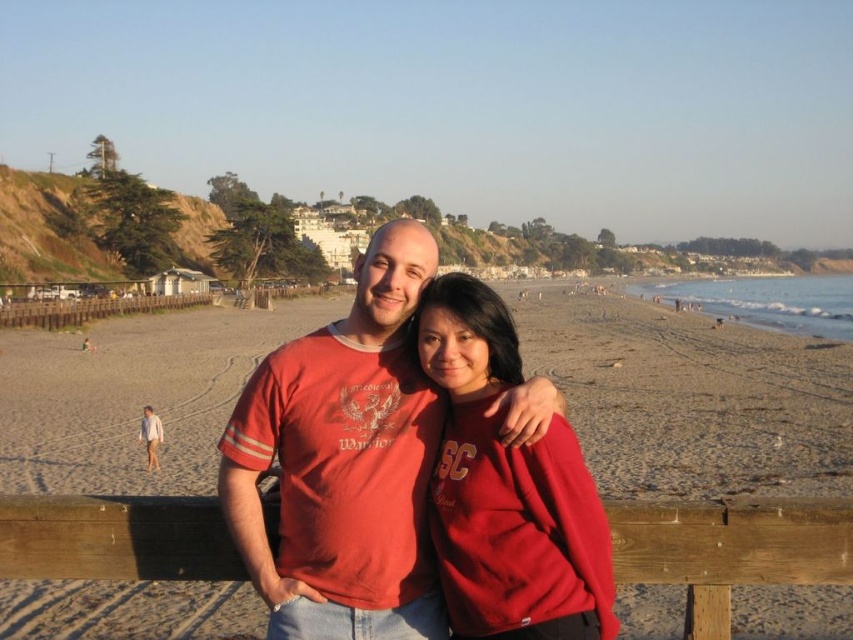
Is matte red t-shirt at center smaller than matte red sweatshirt at center?

No.

Does matte red t-shirt at center lie behind matte red sweatshirt at center?

Yes.

Is point (283, 628) closer to viewer compared to point (573, 609)?

No.

At what (x,y) coordinates should I click in order to perform the action: click on matte red t-shirt at center. Please return your answer as a coordinate pair (x, y). This screenshot has width=853, height=640. Looking at the image, I should click on (343, 461).

Which is in front, point (253, 372) or point (178, 497)?

Point (178, 497)

Does matte red t-shirt at center have a lesser width compared to wooden at lower center?

Indeed, matte red t-shirt at center has a lesser width compared to wooden at lower center.

Identify the location of matte red t-shirt at center. This screenshot has height=640, width=853. (343, 461).

Which of these two, matte red shirt at center or matte red sweatshirt at center, stands taller?

Standing taller between the two is matte red shirt at center.

This screenshot has height=640, width=853. Describe the element at coordinates (698, 388) in the screenshot. I see `matte red shirt at center` at that location.

You are a GUI agent. You are given a task and a screenshot of the screen. Output one action in this format:
    pyautogui.click(x=<x>, y=<y>)
    Task: Click on the matte red shirt at center
    The width and height of the screenshot is (853, 640).
    Given the screenshot: What is the action you would take?
    pyautogui.click(x=698, y=388)